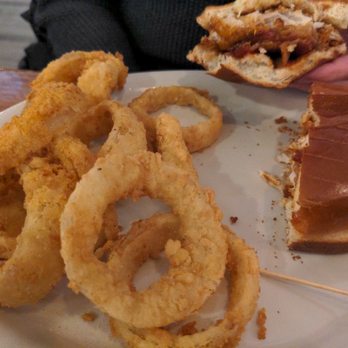
Where is `half of sandwich on plate`? The height and width of the screenshot is (348, 348). half of sandwich on plate is located at coordinates (328, 219).